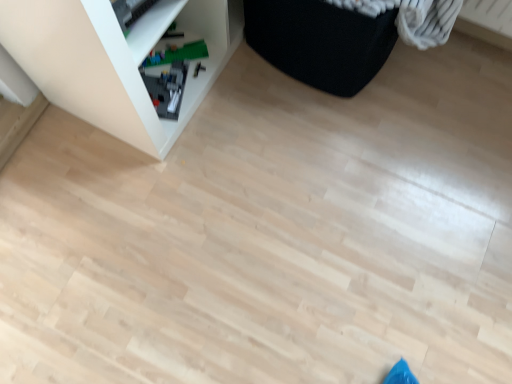
Find the location of a particular element. Image resolution: width=512 pixels, height=384 pixels. free location to the right of green plastic toy at lower left is located at coordinates (219, 64).